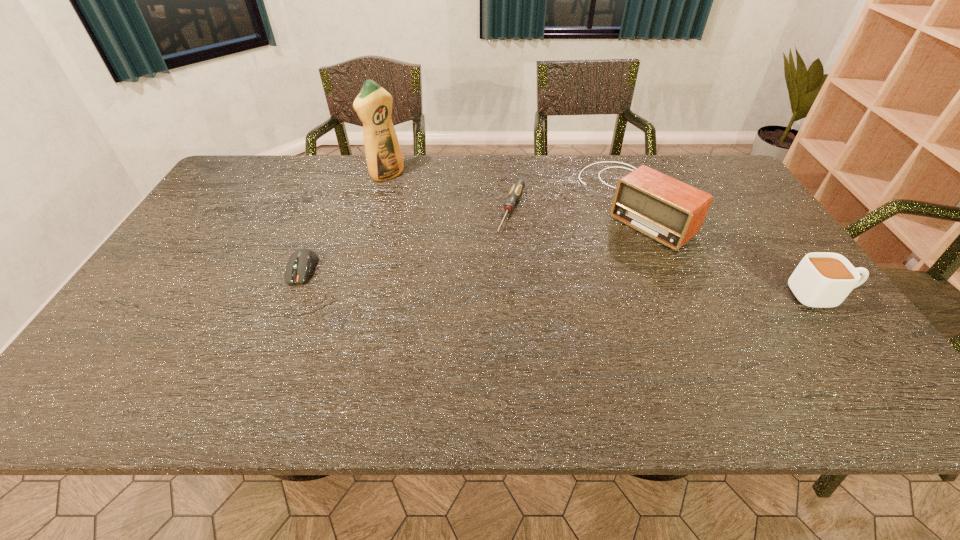
What are the coordinates of `free region located 0.130m on the button of the second shortest object` in the screenshot? It's located at (278, 327).

Locate an element on the screen. The height and width of the screenshot is (540, 960). blank area located on the label of the tallest object is located at coordinates (430, 206).

At what (x,y) coordinates should I click in order to perform the action: click on vacant space located 0.400m on the label of the tallest object. Please return your answer as a coordinate pair (x, y). Image resolution: width=960 pixels, height=540 pixels. Looking at the image, I should click on click(477, 241).

The height and width of the screenshot is (540, 960). Identify the location of vacant region located 0.190m on the label of the tallest object. (432, 207).

Where is `blank area located on the front-facing side of the radio receiver`? blank area located on the front-facing side of the radio receiver is located at coordinates (540, 286).

Where is `vacant space located 0.250m on the front-facing side of the radio receiver`? vacant space located 0.250m on the front-facing side of the radio receiver is located at coordinates click(x=551, y=279).

The width and height of the screenshot is (960, 540). I want to click on vacant area situated 0.400m on the front-facing side of the radio receiver, so click(x=510, y=309).

Where is `vacant space located 0.270m insert the third object from right to left into a screw head`? This screenshot has width=960, height=540. vacant space located 0.270m insert the third object from right to left into a screw head is located at coordinates (480, 303).

At what (x,y) coordinates should I click in order to perform the action: click on vacant region located insert the third object from right to left into a screw head. Please return your answer as a coordinate pair (x, y). Looking at the image, I should click on (473, 318).

I want to click on blank area located 0.100m insert the third object from right to left into a screw head, so click(499, 258).